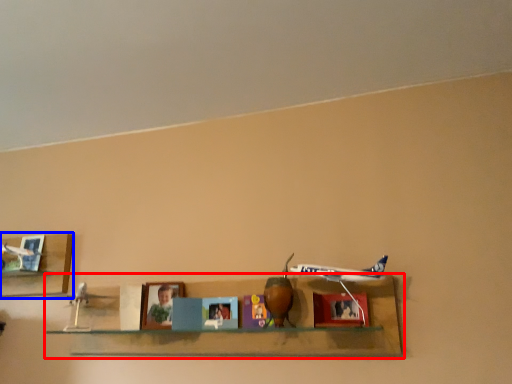
Question: Among these objects, which one is farthest to the camera, shelf (highlighted by a red box) or shelf (highlighted by a blue box)?

Choices:
 (A) shelf
 (B) shelf

Answer: (B)